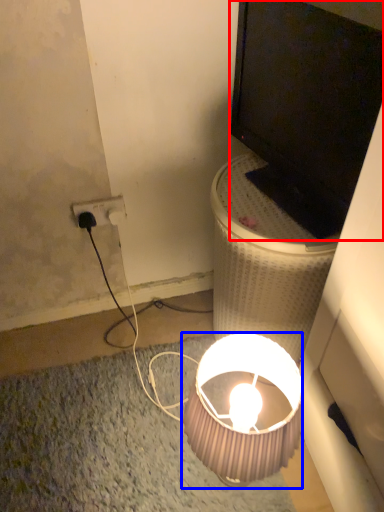
Question: Which object appears farthest to the camera in this image, television (highlighted by a red box) or lamp (highlighted by a blue box)?

Choices:
 (A) television
 (B) lamp

Answer: (B)